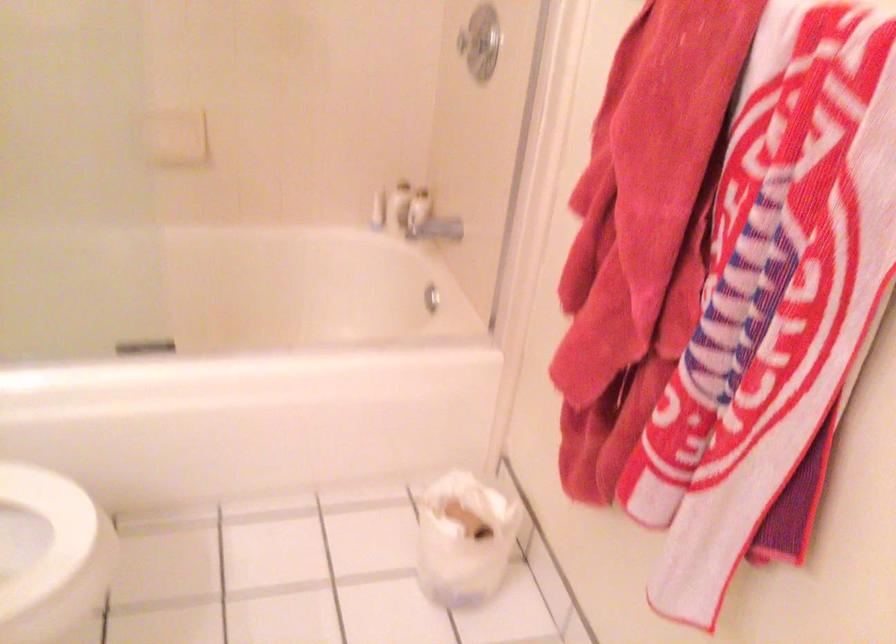
I want to click on faucet diverter lever, so click(x=429, y=221).